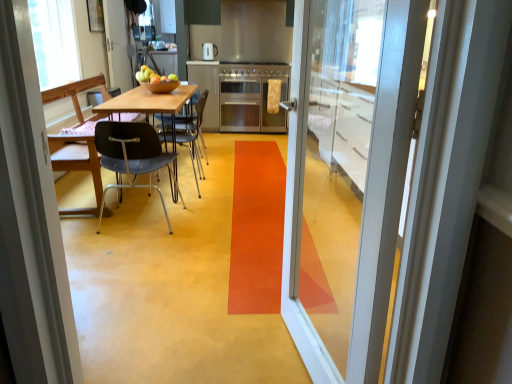
Question: Would you say satin silver refrigerator at center is to the left or to the right of wooden table at center in the picture?

Choices:
 (A) left
 (B) right

Answer: (B)

Question: Is satin silver refrigerator at center bigger or smaller than wooden table at center?

Choices:
 (A) big
 (B) small

Answer: (B)

Question: Estimate the real-world distances between objects in this image. Which object is closer to the shiny brown bowl at center?

Choices:
 (A) wooden table at center
 (B) matte silver kettle at center
 (C) stainless steel oven at center
 (D) metallic blue chair at left, the third chair in the right-to-left sequence
 (E) black plastic chair at left, which is the third chair in left-to-right order

Answer: (A)

Question: Based on their relative distances, which object is nearer to the matte silver kettle at center?

Choices:
 (A) metallic blue chair at left, placed as the first chair when sorted from left to right
 (B) satin silver refrigerator at center
 (C) transparent glass door at center, which is the first door from right to left
 (D) transparent plastic window screen at upper left
 (E) white glossy door at upper left, the second door positioned from the front

Answer: (B)